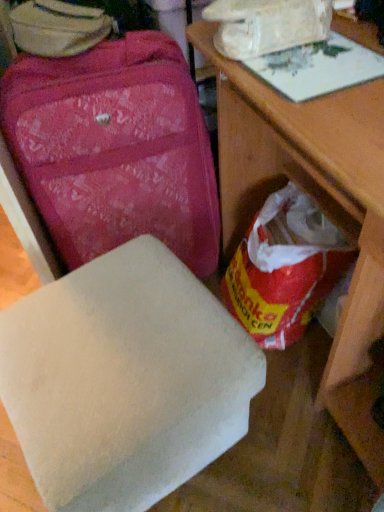
Question: Looking at the image, does matte pink suitcase at upper left seem bigger or smaller compared to red plastic grocery bag at lower right?

Choices:
 (A) big
 (B) small

Answer: (A)

Question: From a real-world perspective, is matte pink suitcase at upper left above or below red plastic grocery bag at lower right?

Choices:
 (A) above
 (B) below

Answer: (A)

Question: Which of these objects is positioned farthest from the white matte foam at lower center?

Choices:
 (A) red plastic grocery bag at lower right
 (B) wooden table at center
 (C) matte pink suitcase at upper left

Answer: (C)

Question: Which object is the closest to the matte pink suitcase at upper left?

Choices:
 (A) white matte foam at lower center
 (B) red plastic grocery bag at lower right
 (C) wooden table at center

Answer: (C)